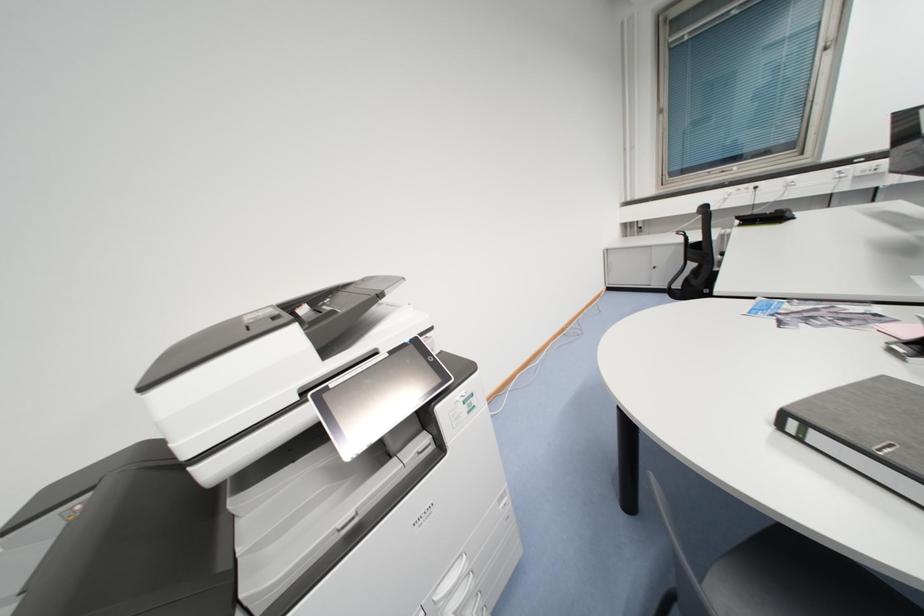
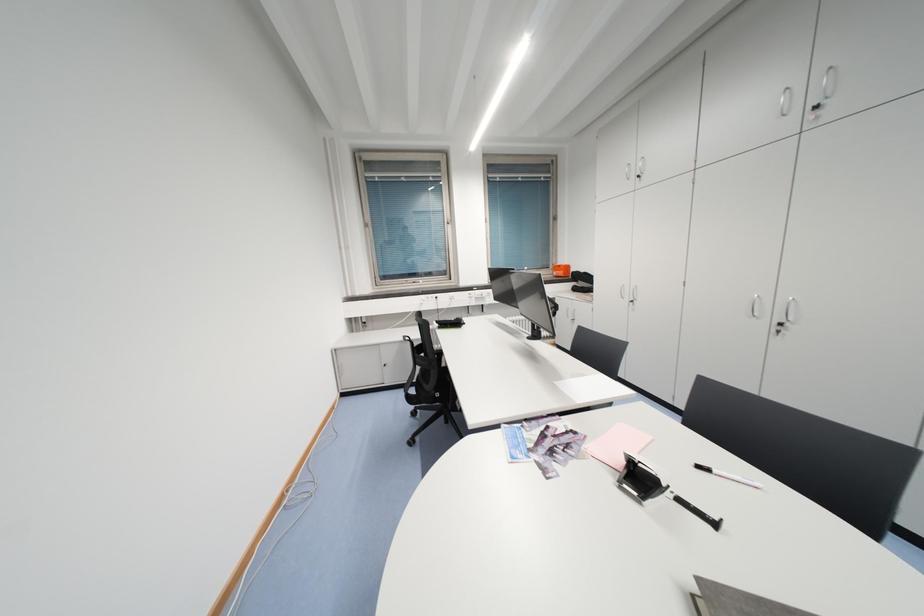
Question: The camera is either moving clockwise (left) or counter-clockwise (right) around the object. The first image is from the beginning of the video and the second image is from the end. Is the camera moving left or right when shooting the video?

Choices:
 (A) Left
 (B) Right

Answer: (A)